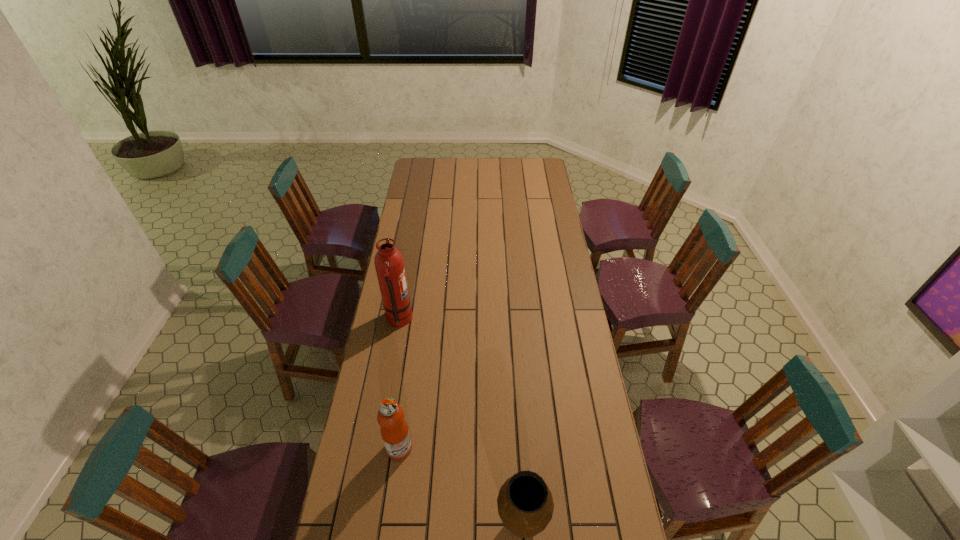
Locate an element on the screen. This screenshot has width=960, height=540. vacant space that is in between the second nearest object and the fire extinguisher is located at coordinates (399, 384).

Identify the location of unoccupied position between the fire extinguisher and the second farthest object. The height and width of the screenshot is (540, 960). (399, 384).

In order to click on object that is the second closest to the second farthest object in this screenshot , I will do `click(389, 264)`.

You are a GUI agent. You are given a task and a screenshot of the screen. Output one action in this format:
    pyautogui.click(x=<x>, y=<y>)
    Task: Click on the object identified as the closest to the nearest object
    This screenshot has height=540, width=960.
    Given the screenshot: What is the action you would take?
    pyautogui.click(x=394, y=430)